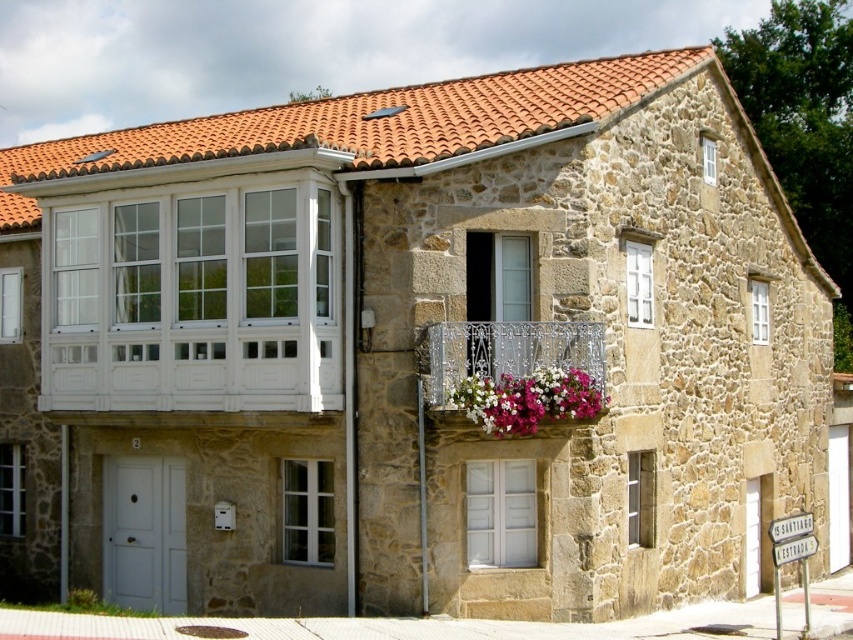
Question: Does wrought iron balcony at center appear under pink fabric flowers at center?

Choices:
 (A) yes
 (B) no

Answer: (B)

Question: Does wrought iron balcony at center have a greater width compared to pink fabric flowers at center?

Choices:
 (A) yes
 (B) no

Answer: (A)

Question: Which of the following is the farthest from the observer?

Choices:
 (A) (587, 385)
 (B) (457, 342)

Answer: (A)

Question: Which point is closer to the camera?

Choices:
 (A) (500, 408)
 (B) (508, 356)

Answer: (A)

Question: Is wrought iron balcony at center smaller than pink fabric flowers at center?

Choices:
 (A) yes
 (B) no

Answer: (B)